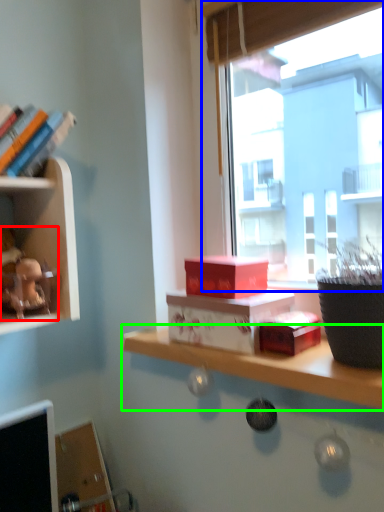
Question: Considering the real-world distances, which object is closest to toy (highlighted by a red box)? window (highlighted by a blue box) or shelf (highlighted by a green box).

Choices:
 (A) window
 (B) shelf

Answer: (B)